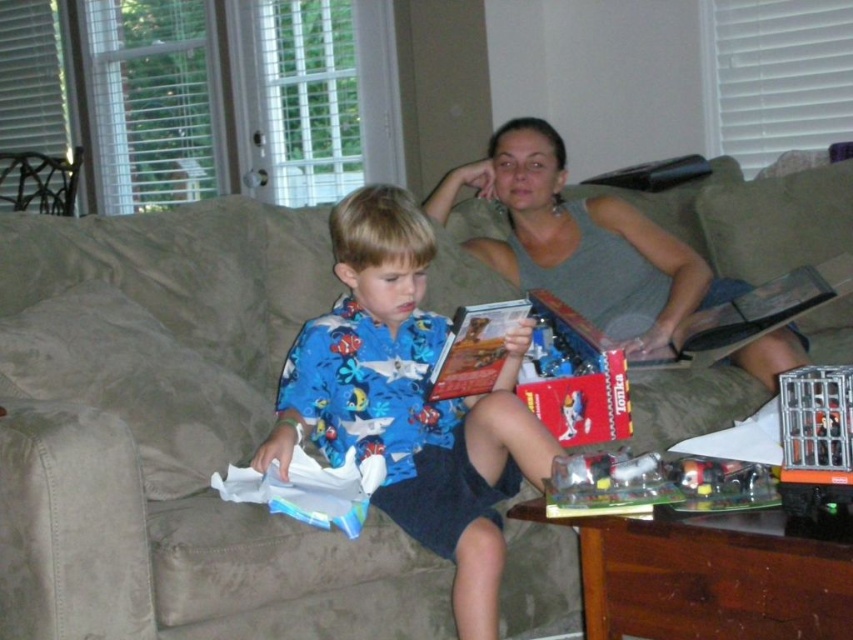
You are a delivery person who needs to place a large package on the floor. The package is too heavy to lift high. You see the gray fabric couch at upper center and the metallic silver cage at lower right. Which object should you place the package near to ensure it stays on the floor?

The metallic silver cage at lower right is shorter than the gray fabric couch at upper center, so placing the package near the metallic silver cage at lower right ensures it stays on the floor since it is lower to the ground.

You are standing in the living room and want to hand a remote control to the person wearing the blue cotton shirt at center. If the remote control is 0.5 meters away from you, can you reach them without moving?

The blue cotton shirt at center is 1.64 meters away from the camera. Since the remote control is only 0.5 meters away from you, you cannot reach the person wearing the blue cotton shirt at center without moving closer.

Based on the photo, you are a delivery robot with a package that needs to be placed between the blue cotton shirt at center and the metallic silver cage at lower right. The package is 25 inches long. Will it fit in the space between them?

The blue cotton shirt at center and the metallic silver cage at lower right are 26.26 inches apart from each other. Since the package is 25 inches long, it will fit in the space between them.